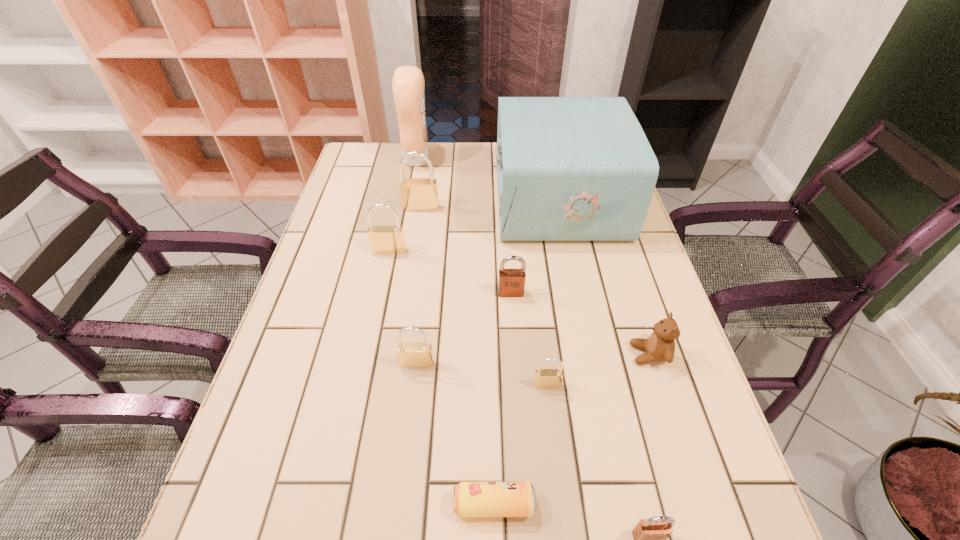
Locate which brass padlock ranks second in proximity to the sixth nearest object. Please provide its 2D coordinates. Your answer should be formatted as a tuple, i.e. [(x, y)], where the tuple contains the x and y coordinates of a point satisfying the conditions above.

[(544, 378)]

At what (x,y) coordinates should I click in order to perform the action: click on vacant region that satisfies the following two spatial constraints: 1. on the back side of the shortest object; 2. on the label of the tallest object. Please return your answer as a coordinate pair (x, y). This screenshot has width=960, height=540. Looking at the image, I should click on (487, 160).